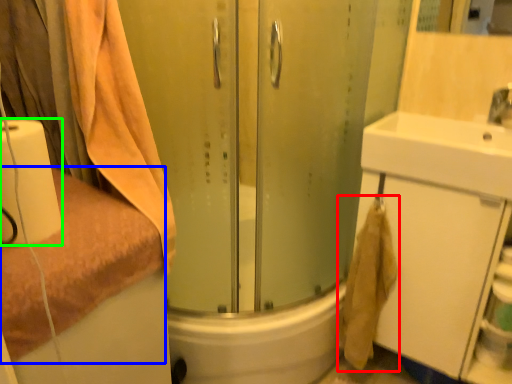
Question: Which object is the farthest from bath towel (highlighted by a red box)? Choose among these: towel (highlighted by a blue box) or toilet paper (highlighted by a green box).

Choices:
 (A) towel
 (B) toilet paper

Answer: (B)